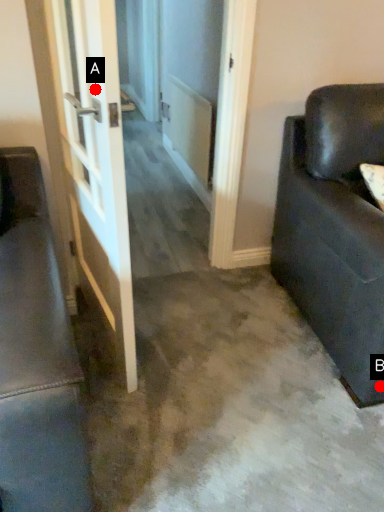
Question: Two points are circled on the image, labeled by A and B beside each circle. Which point appears closest to the camera in this image?

Choices:
 (A) A is closer
 (B) B is closer

Answer: (A)